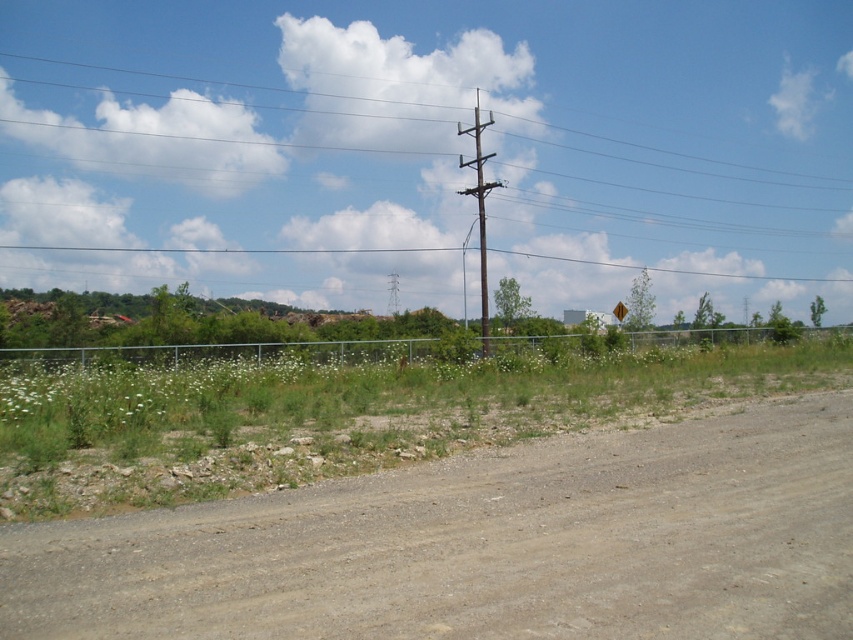
Which is more to the left, brown gravel dirt track at lower left or silver metallic fence at center?

From the viewer's perspective, brown gravel dirt track at lower left appears more on the left side.

Can you confirm if brown gravel dirt track at lower left is positioned to the left of silver metallic fence at center?

Correct, you'll find brown gravel dirt track at lower left to the left of silver metallic fence at center.

This screenshot has height=640, width=853. What do you see at coordinates (485, 545) in the screenshot?
I see `brown gravel dirt track at lower left` at bounding box center [485, 545].

Where is `brown gravel dirt track at lower left`? brown gravel dirt track at lower left is located at coordinates (485, 545).

Which of these two, brown gravel dirt track at lower left or yellow reflective plastic at right, stands shorter?

Standing shorter between the two is brown gravel dirt track at lower left.

You are a GUI agent. You are given a task and a screenshot of the screen. Output one action in this format:
    pyautogui.click(x=<x>, y=<y>)
    Task: Click on the brown gravel dirt track at lower left
    
    Given the screenshot: What is the action you would take?
    pyautogui.click(x=485, y=545)

Does silver metallic fence at center have a larger size compared to brown wooden pole at upper center?

Actually, silver metallic fence at center might be smaller than brown wooden pole at upper center.

Which is in front, point (660, 339) or point (653, 220)?

Point (660, 339)

Image resolution: width=853 pixels, height=640 pixels. In order to click on silver metallic fence at center in this screenshot , I will do `click(248, 353)`.